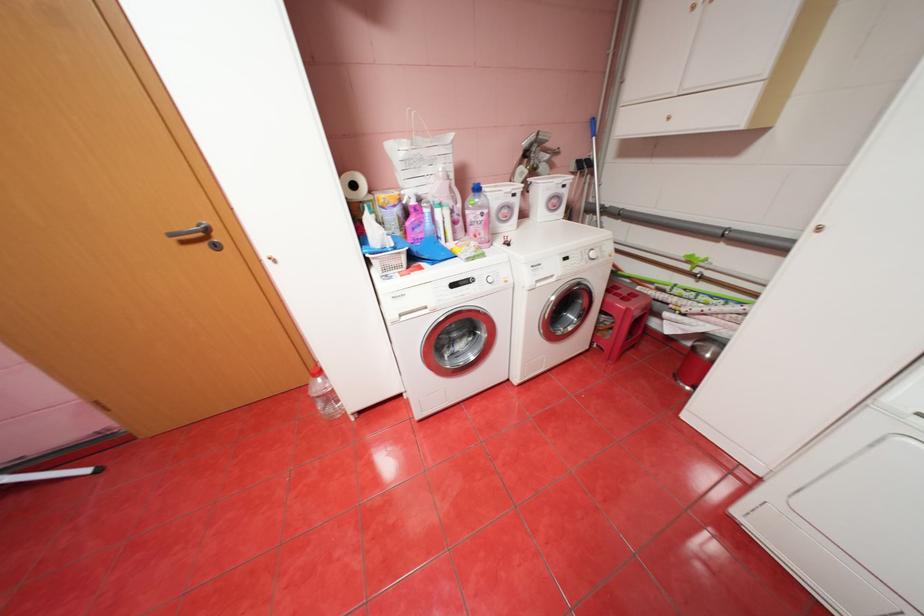
Find where to lift the blue softener bottle. Please return your answer as a coordinate pair (x, y).

(478, 216)